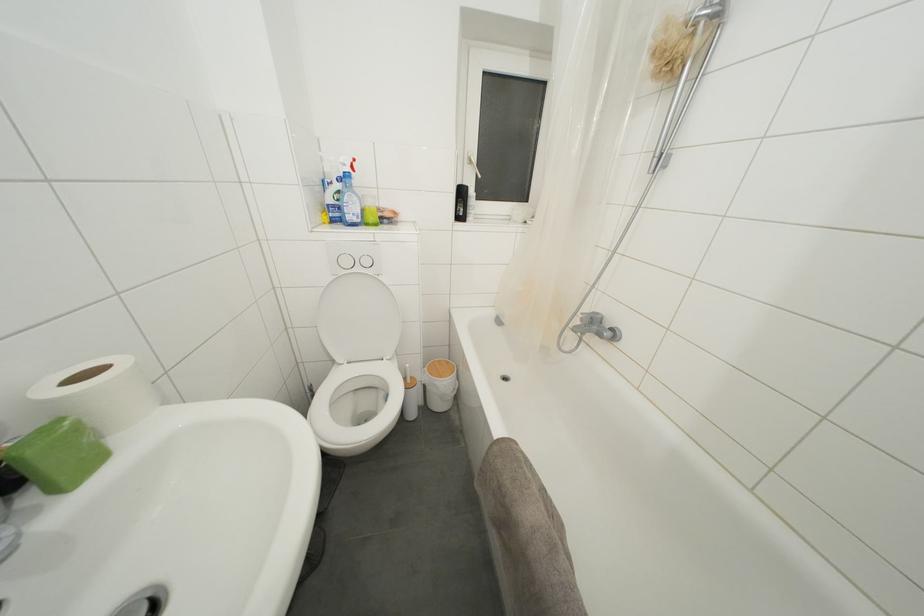
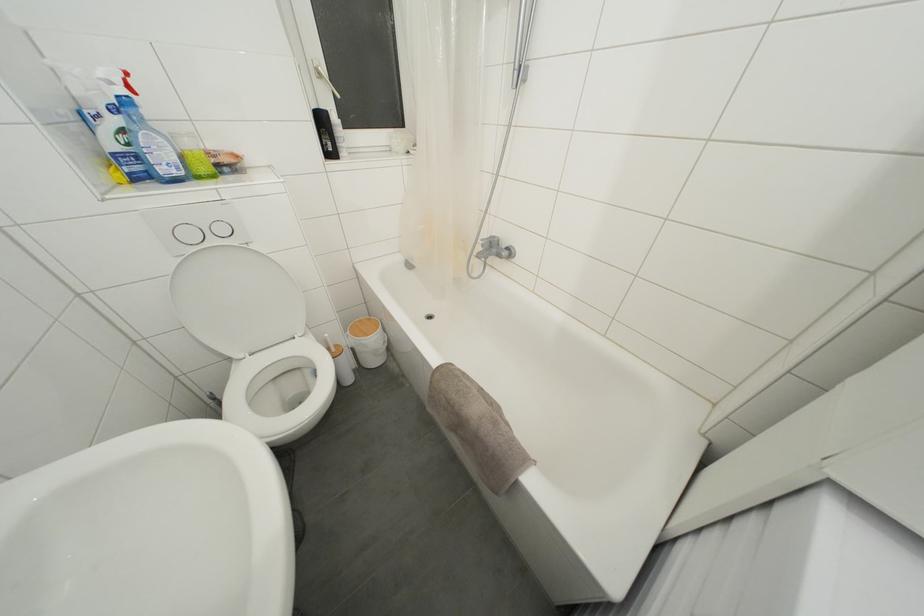
In the second image, find the point that corresponds to pixel 444 366 in the first image.

(363, 326)